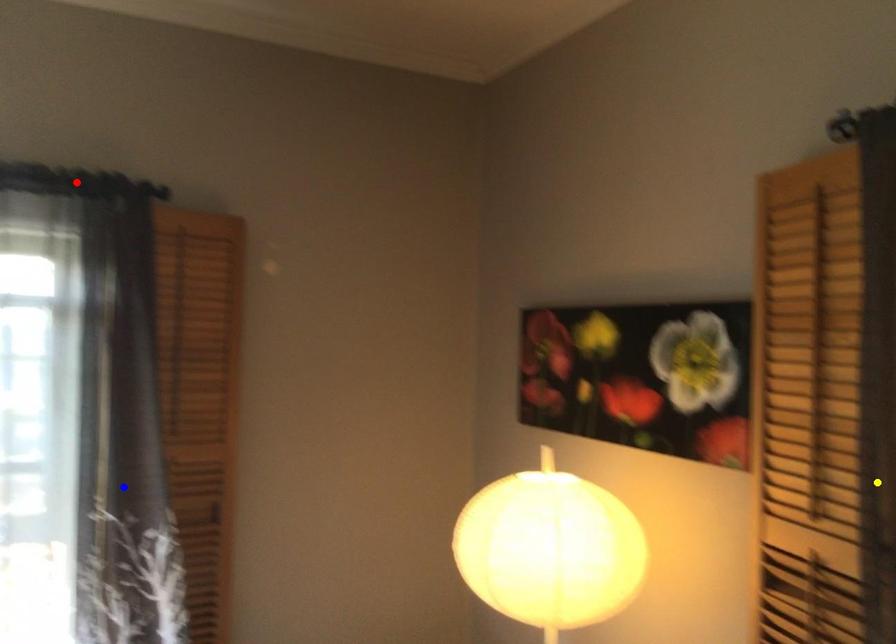
In the scene shown: Order these from nearest to farthest:
yellow point
red point
blue point

yellow point < red point < blue point